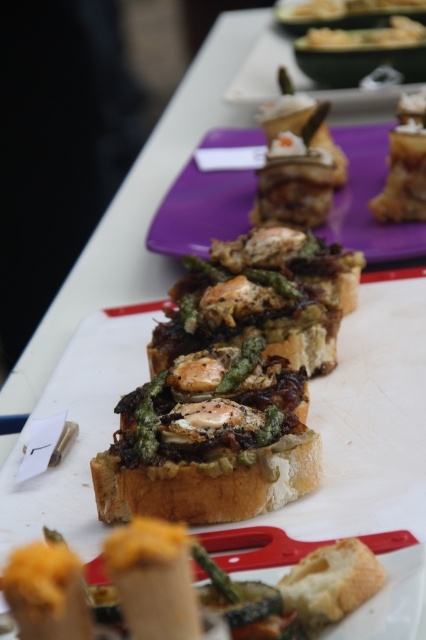
Question: Which of the following is the farthest from the observer?

Choices:
 (A) golden brown bread at center
 (B) golden brown crusty bread at center
 (C) matte purple plate at center
 (D) savory bread with asparagus and egg at upper right

Answer: (D)

Question: Is golden brown bread at center smaller than savory bread with asparagus and egg at upper right?

Choices:
 (A) yes
 (B) no

Answer: (B)

Question: In this image, where is matte purple plate at center located relative to savory bread with asparagus and egg at upper right?

Choices:
 (A) right
 (B) left

Answer: (B)

Question: Based on their relative distances, which object is nearer to the golden brown bread at center?

Choices:
 (A) golden brown crusty bread at center
 (B) savory bread with asparagus and egg at upper right

Answer: (A)

Question: Can you confirm if matte purple plate at center is positioned to the right of golden brown crusty bread at center?

Choices:
 (A) yes
 (B) no

Answer: (A)

Question: Which is nearer to the savory bread with asparagus and egg at upper right?

Choices:
 (A) golden brown crusty bread at center
 (B) matte purple plate at center
 (C) golden brown bread at center

Answer: (B)